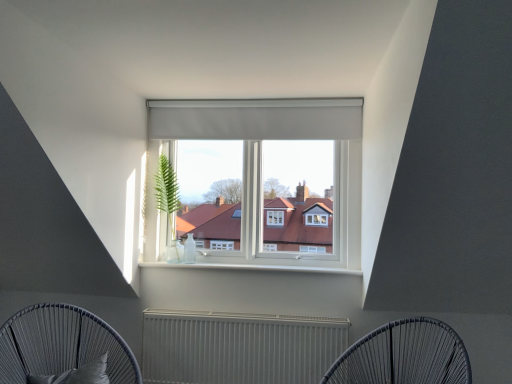
Question: From the image's perspective, does matte gray curtain at center appear higher than dark grey woven chair at lower left, which appears as the second furniture when viewed from the right?

Choices:
 (A) no
 (B) yes

Answer: (B)

Question: Can you confirm if matte gray curtain at center is positioned to the right of dark grey woven chair at lower left, which appears as the second furniture when viewed from the right?

Choices:
 (A) yes
 (B) no

Answer: (A)

Question: Is dark grey woven chair at lower left, which ranks as the first furniture in left-to-right order, surrounded by matte gray curtain at center?

Choices:
 (A) no
 (B) yes

Answer: (A)

Question: Would you say matte gray curtain at center is a long distance from dark grey woven chair at lower left, which ranks as the first furniture in left-to-right order?

Choices:
 (A) no
 (B) yes

Answer: (B)

Question: From a real-world perspective, is matte gray curtain at center positioned over dark grey woven chair at lower left, which ranks as the first furniture in left-to-right order, based on gravity?

Choices:
 (A) yes
 (B) no

Answer: (A)

Question: From the image's perspective, is dark grey woven chair at lower left, which appears as the second furniture when viewed from the right, positioned above or below metallic wire chair at lower center, placed as the second furniture when sorted from left to right?

Choices:
 (A) below
 (B) above

Answer: (A)

Question: Is dark grey woven chair at lower left, which ranks as the first furniture in left-to-right order, in front of or behind metallic wire chair at lower center, placed as the second furniture when sorted from left to right, in the image?

Choices:
 (A) behind
 (B) front

Answer: (A)

Question: Considering the positions of dark grey woven chair at lower left, which appears as the second furniture when viewed from the right, and metallic wire chair at lower center, placed as the second furniture when sorted from left to right, in the image, is dark grey woven chair at lower left, which appears as the second furniture when viewed from the right, taller or shorter than metallic wire chair at lower center, placed as the second furniture when sorted from left to right,?

Choices:
 (A) short
 (B) tall

Answer: (B)

Question: From a real-world perspective, is dark grey woven chair at lower left, which appears as the second furniture when viewed from the right, physically located above or below metallic wire chair at lower center, placed as the second furniture when sorted from left to right?

Choices:
 (A) below
 (B) above

Answer: (A)

Question: From a real-world perspective, is green leafy plant at center positioned above or below dark grey woven chair at lower left, which appears as the second furniture when viewed from the right?

Choices:
 (A) above
 (B) below

Answer: (A)

Question: Considering the positions of green leafy plant at center and dark grey woven chair at lower left, which appears as the second furniture when viewed from the right, in the image, is green leafy plant at center wider or thinner than dark grey woven chair at lower left, which appears as the second furniture when viewed from the right,?

Choices:
 (A) wide
 (B) thin

Answer: (B)

Question: Is green leafy plant at center taller or shorter than dark grey woven chair at lower left, which appears as the second furniture when viewed from the right?

Choices:
 (A) tall
 (B) short

Answer: (A)

Question: In the image, is green leafy plant at center positioned in front of or behind dark grey woven chair at lower left, which ranks as the first furniture in left-to-right order?

Choices:
 (A) front
 (B) behind

Answer: (B)

Question: Considering the positions of metallic radiator at center and matte gray curtain at center in the image, is metallic radiator at center wider or thinner than matte gray curtain at center?

Choices:
 (A) wide
 (B) thin

Answer: (A)

Question: Is metallic radiator at center inside the boundaries of matte gray curtain at center, or outside?

Choices:
 (A) inside
 (B) outside

Answer: (B)